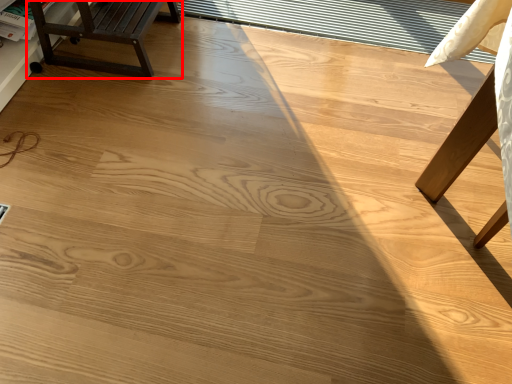
Question: From the image's perspective, what is the correct spatial positioning of furniture (annotated by the red box) in reference to window?

Choices:
 (A) above
 (B) below

Answer: (B)